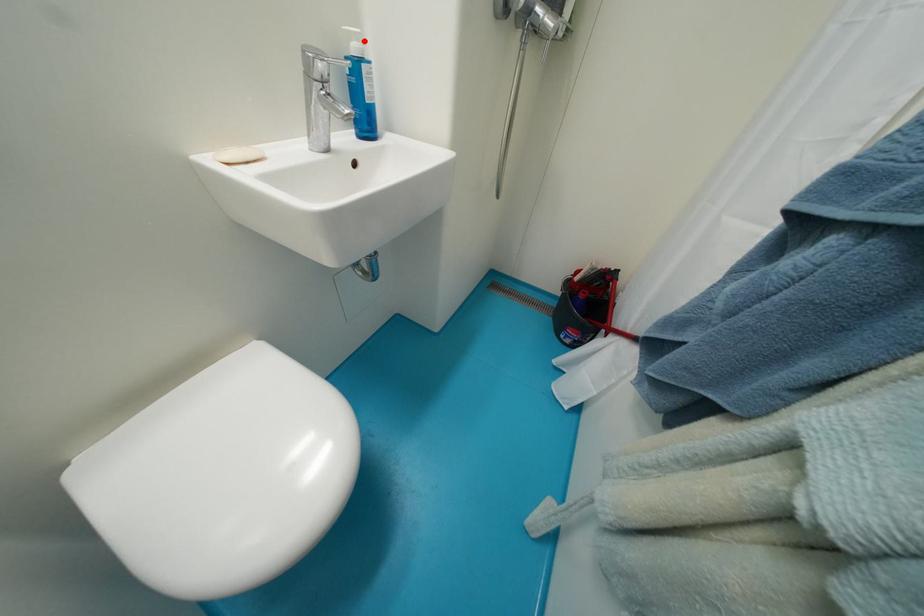
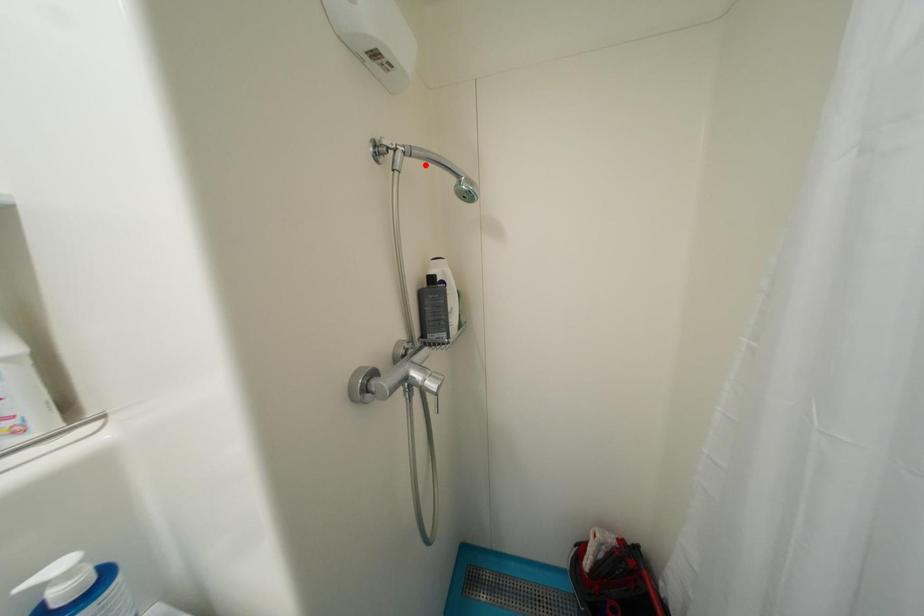
I am providing you with two images of the same scene from different viewpoints. A red point is marked on the first image and another point is marked on the second image. Is the red point in image1 aligned with the point shown in image2?

No